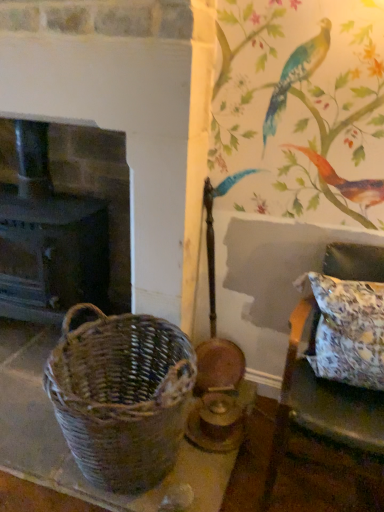
Question: Is woven brown picnic basket at left facing away from floral fabric pillow at right?

Choices:
 (A) no
 (B) yes

Answer: (A)

Question: From a real-world perspective, is woven brown picnic basket at left located beneath floral fabric pillow at right?

Choices:
 (A) no
 (B) yes

Answer: (B)

Question: Can you confirm if woven brown picnic basket at left is bigger than floral fabric pillow at right?

Choices:
 (A) no
 (B) yes

Answer: (B)

Question: Is woven brown picnic basket at left located outside floral fabric pillow at right?

Choices:
 (A) no
 (B) yes

Answer: (B)

Question: Is woven brown picnic basket at left smaller than floral fabric pillow at right?

Choices:
 (A) yes
 (B) no

Answer: (B)

Question: Is woven brown picnic basket at left behind floral fabric pillow at right?

Choices:
 (A) yes
 (B) no

Answer: (B)

Question: Considering the relative sizes of floral fabric pillow at right and dark brown wood fireplace at left in the image provided, is floral fabric pillow at right thinner than dark brown wood fireplace at left?

Choices:
 (A) no
 (B) yes

Answer: (B)

Question: Is floral fabric pillow at right not inside dark brown wood fireplace at left?

Choices:
 (A) no
 (B) yes

Answer: (B)

Question: Does floral fabric pillow at right come in front of dark brown wood fireplace at left?

Choices:
 (A) no
 (B) yes

Answer: (B)

Question: Does floral fabric pillow at right appear on the left side of dark brown wood fireplace at left?

Choices:
 (A) no
 (B) yes

Answer: (A)

Question: Is floral fabric pillow at right to the right of dark brown wood fireplace at left from the viewer's perspective?

Choices:
 (A) no
 (B) yes

Answer: (B)

Question: Is dark brown wood fireplace at left located within floral fabric pillow at right?

Choices:
 (A) no
 (B) yes

Answer: (A)

Question: From the image's perspective, is woven brown picnic basket at left located above dark brown wood fireplace at left?

Choices:
 (A) yes
 (B) no

Answer: (B)